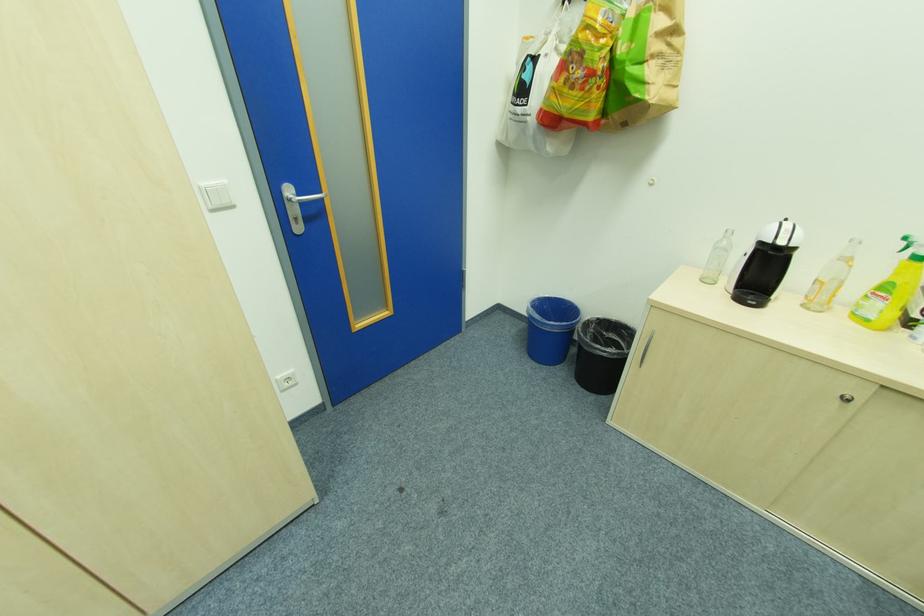
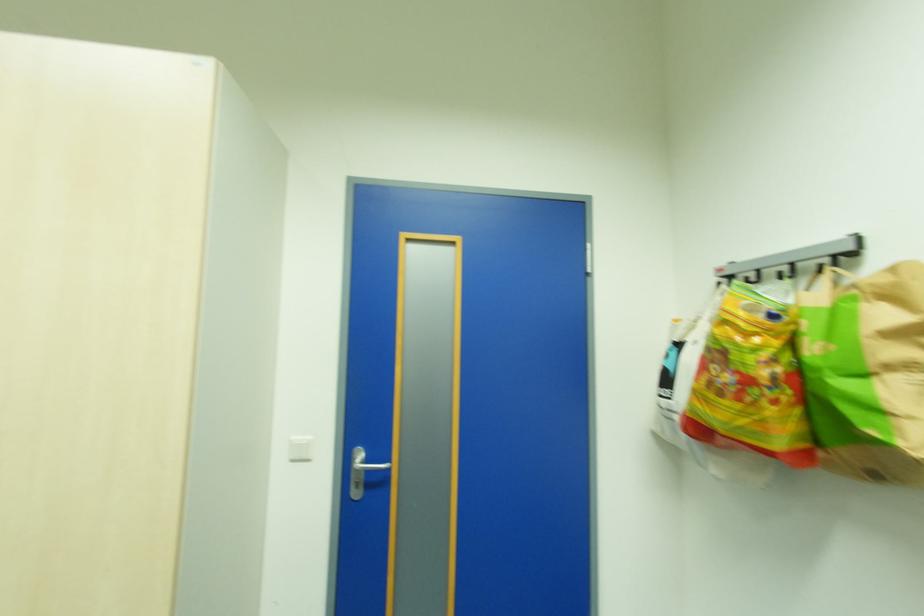
First-person continuous shooting, in which direction is the camera rotating?

The camera rotated toward left-up.